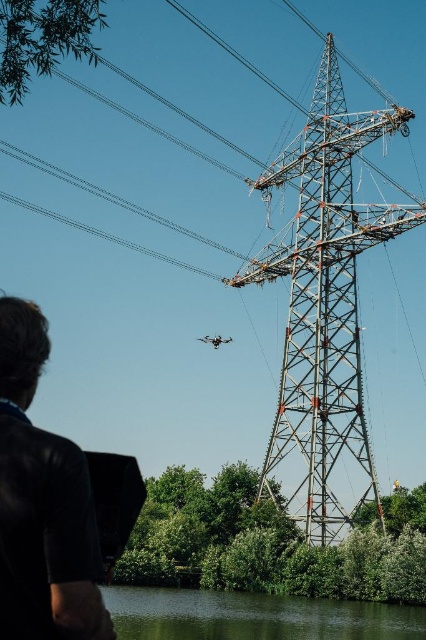
You are standing at the base of the power transmission tower and see two points marked in the image. The first point is at coordinates point (0, 380) and the second is at point (350, 620). From your vantage point, which point is closer to you?

Point (0, 380) is closer to you because it is in front of point (350, 620).